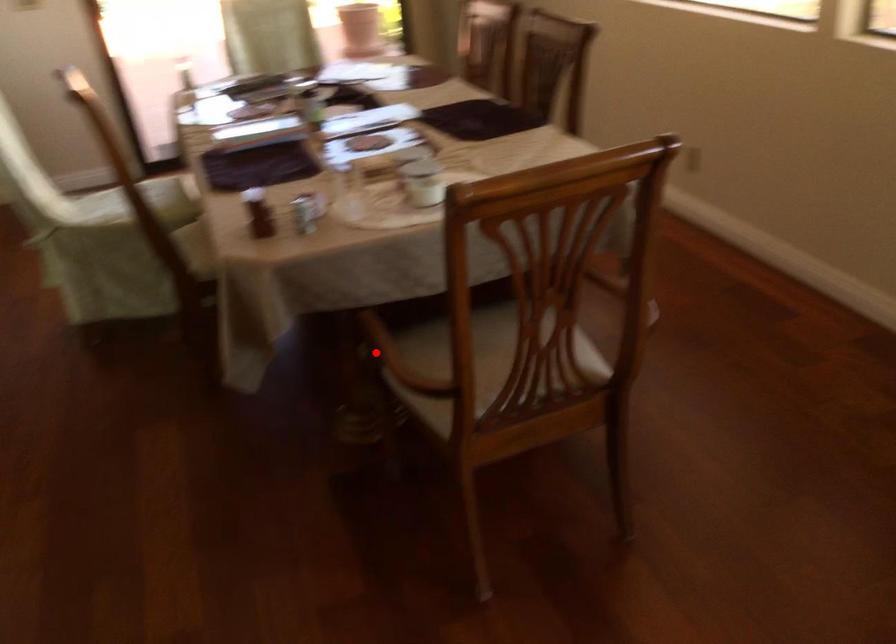
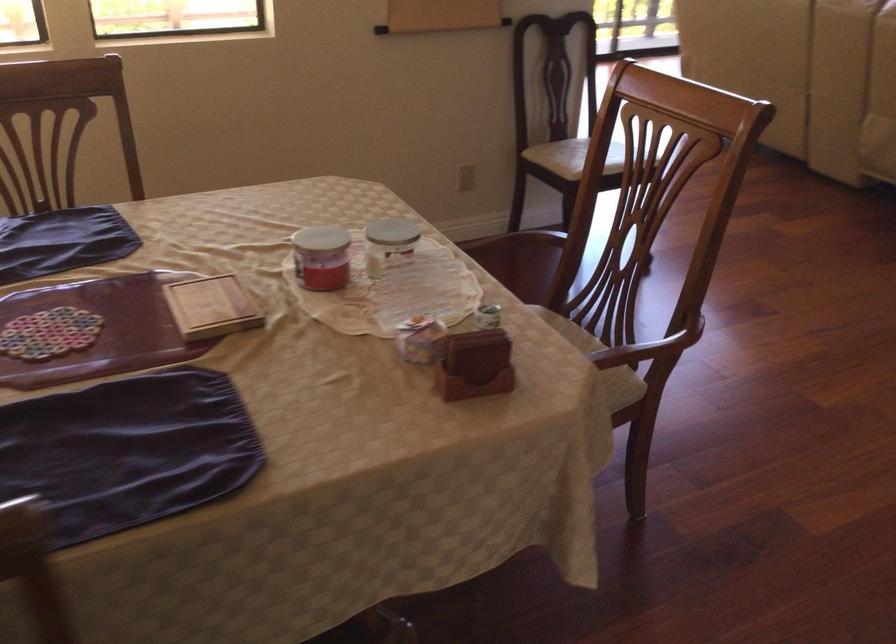
Question: I am providing you with two images of the same scene from different viewpoints. In image1, a red point is highlighted. Considering the same 3D point in image2, which of the following is correct?

Choices:
 (A) It is closer
 (B) It is farther

Answer: (A)